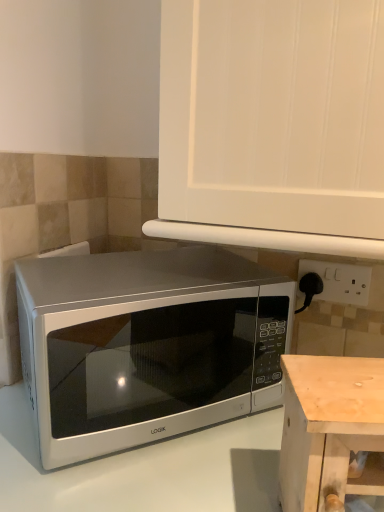
Question: From their relative heights in the image, would you say pine wood table at lower right is taller or shorter than white glossy microwave at lower left?

Choices:
 (A) short
 (B) tall

Answer: (A)

Question: Is point (350, 426) positioned closer to the camera than point (200, 456)?

Choices:
 (A) farther
 (B) closer

Answer: (B)

Question: Estimate the real-world distances between objects in this image. Which object is closer to the white matte cabinet at upper center?

Choices:
 (A) white plastic electric outlet at right
 (B) satin silver microwave at center
 (C) white glossy microwave at lower left
 (D) pine wood table at lower right

Answer: (B)

Question: Which of these objects is positioned closest to the white plastic electric outlet at right?

Choices:
 (A) satin silver microwave at center
 (B) white matte cabinet at upper center
 (C) white glossy microwave at lower left
 (D) pine wood table at lower right

Answer: (A)